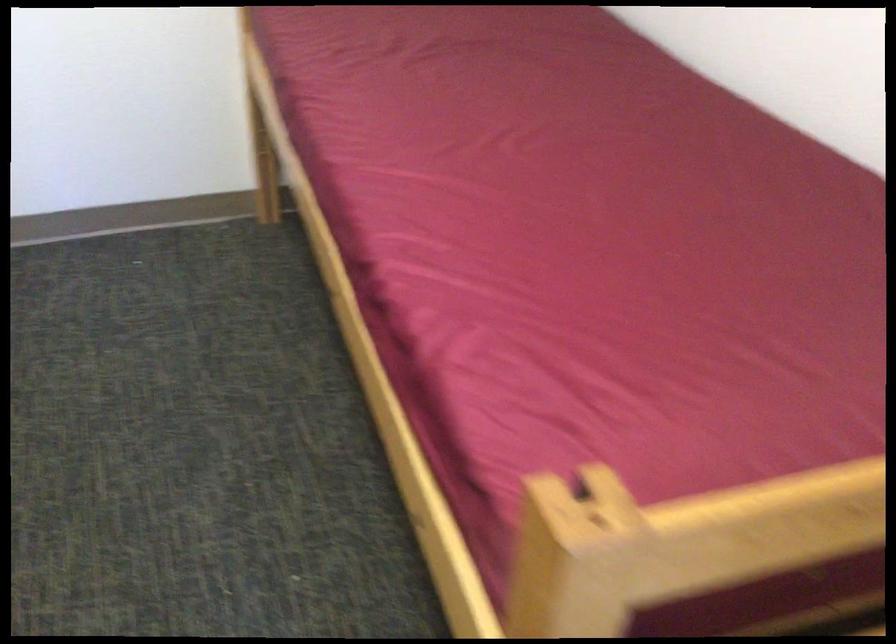
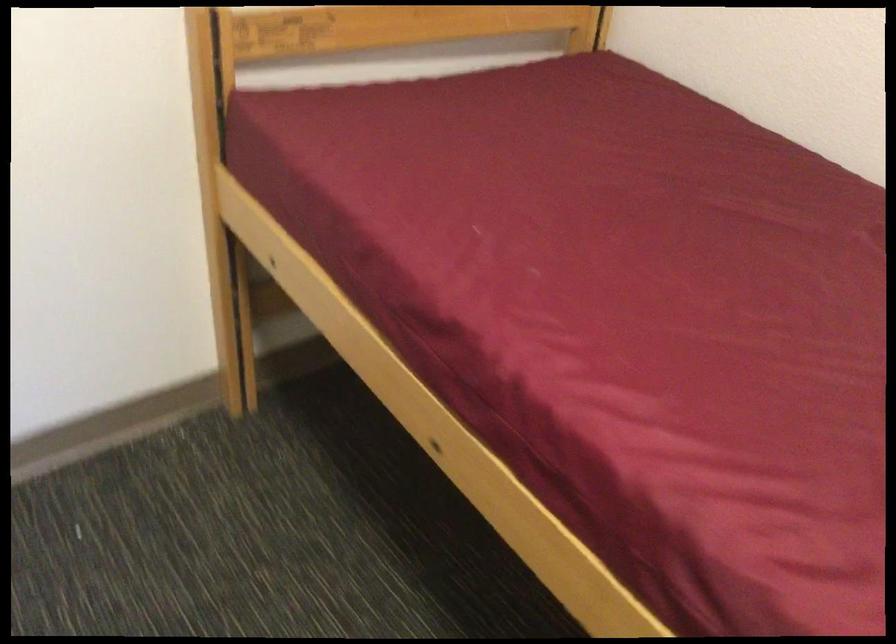
The images are taken continuously from a first-person perspective. In which direction are you moving?

The cameraman moved toward left, forward.